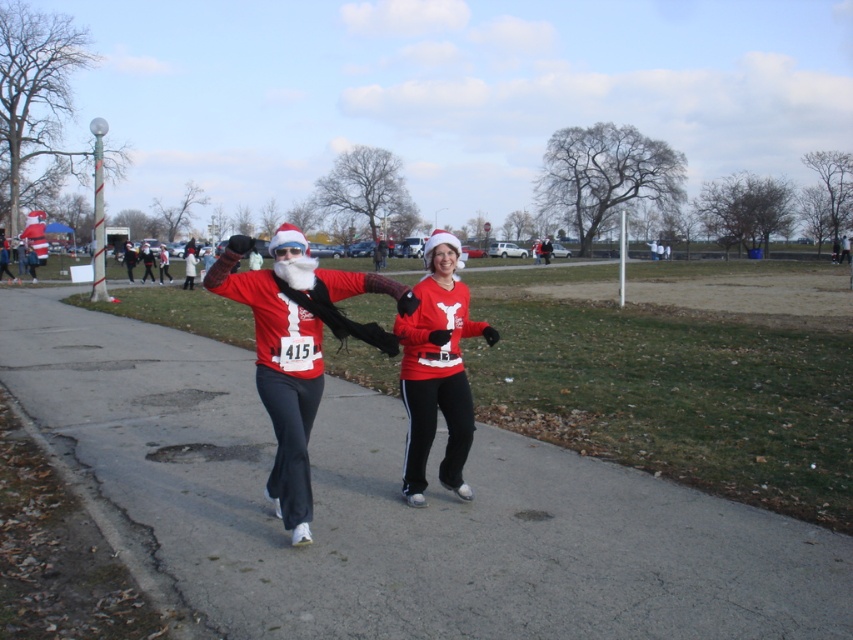
Question: Which of these objects is positioned closest to the matte red santa suit at center?

Choices:
 (A) smooth asphalt road at center
 (B) matte red sweater at center

Answer: (B)

Question: Which object is farther from the camera taking this photo?

Choices:
 (A) matte red santa suit at center
 (B) smooth asphalt road at center

Answer: (A)

Question: Is smooth asphalt road at center behind matte red santa suit at center?

Choices:
 (A) no
 (B) yes

Answer: (A)

Question: Considering the relative positions of smooth asphalt road at center and matte red santa suit at center in the image provided, where is smooth asphalt road at center located with respect to matte red santa suit at center?

Choices:
 (A) right
 (B) left

Answer: (B)

Question: Can you confirm if smooth asphalt road at center is positioned to the right of matte red santa suit at center?

Choices:
 (A) yes
 (B) no

Answer: (B)

Question: Estimate the real-world distances between objects in this image. Which object is farther from the matte red santa suit at center?

Choices:
 (A) matte red sweater at center
 (B) smooth asphalt road at center

Answer: (B)